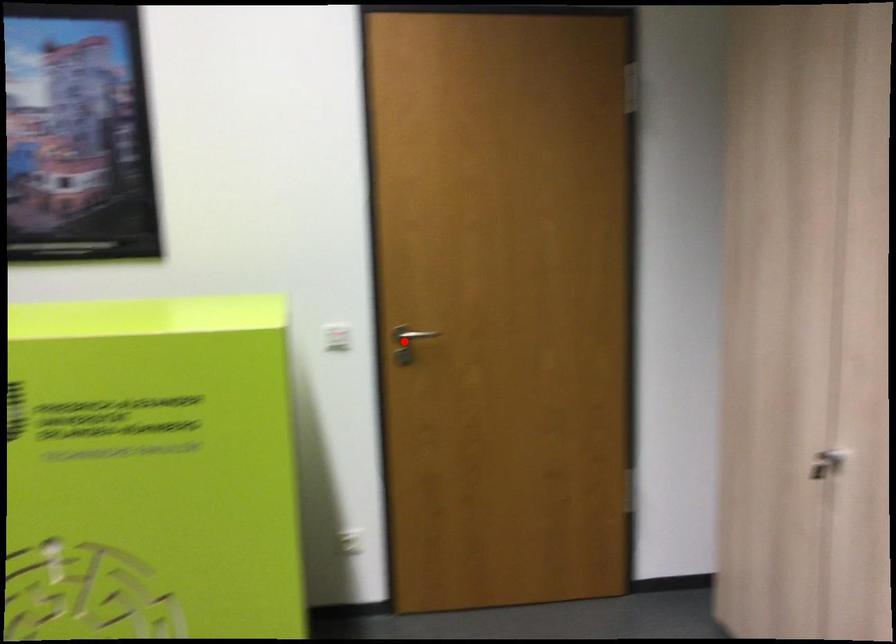
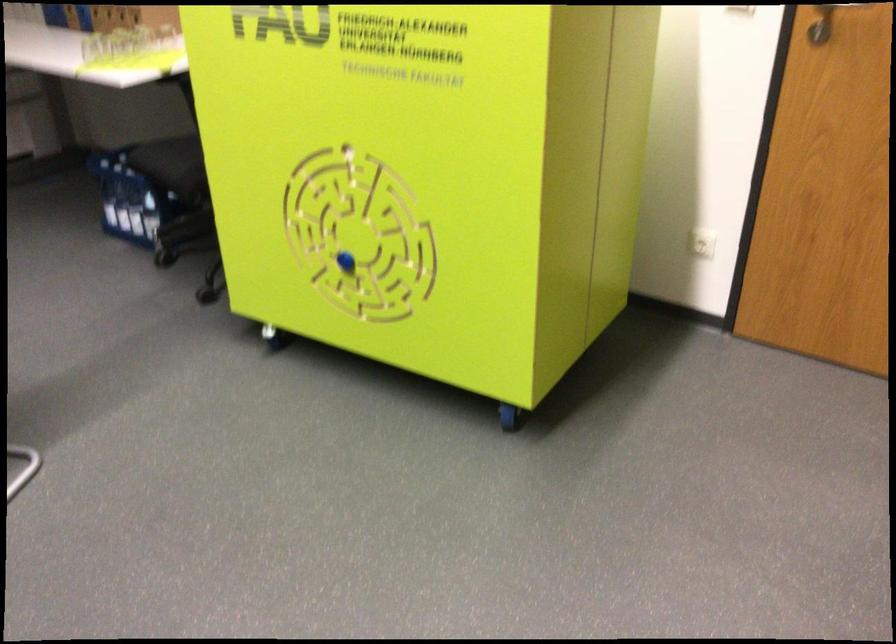
Question: I am providing you with two images of the same scene from different viewpoints. In image1, a red point is highlighted. Considering the same 3D point in image2, which of the following is correct?

Choices:
 (A) It is closer
 (B) It is farther

Answer: (A)